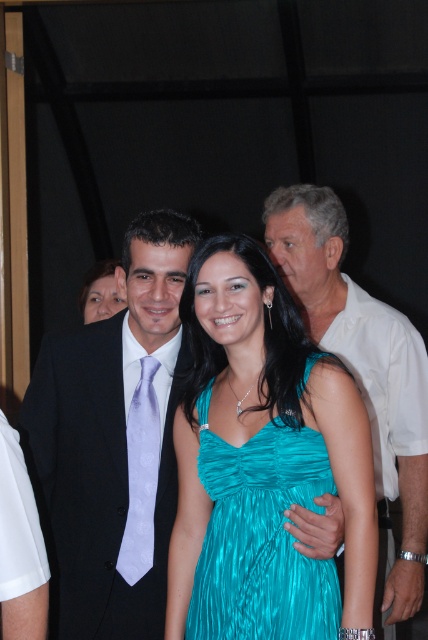
You are standing at the entrance of the venue and want to locate the teal shiny dress at center. According to the coordinates provided, where should you look relative to the entrance?

The teal shiny dress at center is located at coordinates point (x=261, y=538). Since the entrance is typically at the edge of the venue, the dress is positioned towards the center area, so you should look towards the center of the venue to find it.

You are a photographer at the event and need to adjust the lighting so that both the black satin suit at center and the teal shiny dress at center are equally visible. Considering their positions, which one might require more light adjustment?

The teal shiny dress at center is behind the black satin suit at center, so it might require more light adjustment to ensure it is equally visible since it is farther away from the camera.